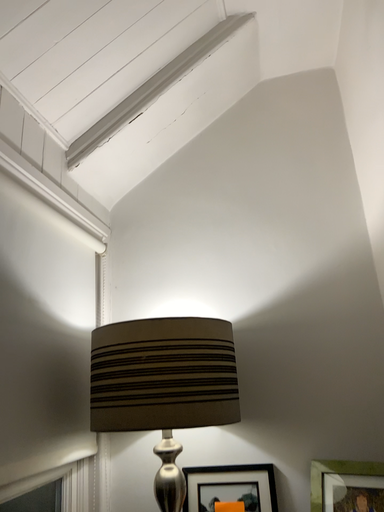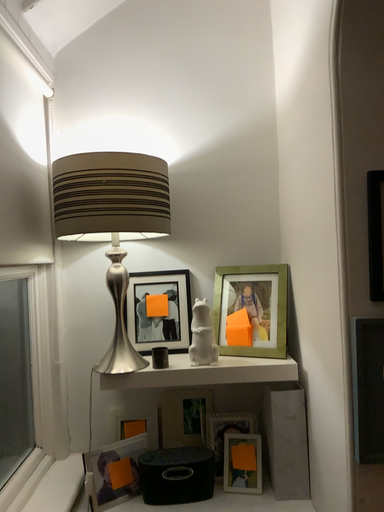
Question: How did the camera likely rotate when shooting the video?

Choices:
 (A) rotated right
 (B) rotated left

Answer: (A)